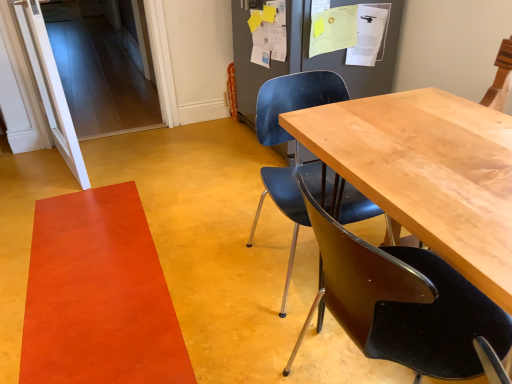
Question: From the image's perspective, does orange matte rug at lower left appear lower than light brown wood table at center?

Choices:
 (A) yes
 (B) no

Answer: (A)

Question: Can you confirm if orange matte rug at lower left is taller than light brown wood table at center?

Choices:
 (A) yes
 (B) no

Answer: (B)

Question: Is orange matte rug at lower left positioned beyond the bounds of light brown wood table at center?

Choices:
 (A) no
 (B) yes

Answer: (B)

Question: Is orange matte rug at lower left shorter than light brown wood table at center?

Choices:
 (A) yes
 (B) no

Answer: (A)

Question: Does orange matte rug at lower left come in front of light brown wood table at center?

Choices:
 (A) no
 (B) yes

Answer: (A)

Question: In the image, is matte black chair at center, which is counted as the 1th chair, starting from the back, positioned in front of or behind orange matte rug at lower left?

Choices:
 (A) front
 (B) behind

Answer: (A)

Question: Is matte black chair at center, which is counted as the second chair, starting from the front, wider or thinner than orange matte rug at lower left?

Choices:
 (A) wide
 (B) thin

Answer: (B)

Question: Considering the positions of point (258, 94) and point (62, 379), is point (258, 94) closer or farther from the camera than point (62, 379)?

Choices:
 (A) farther
 (B) closer

Answer: (A)

Question: Considering the relative positions of matte black chair at center, which is counted as the second chair, starting from the front, and orange matte rug at lower left in the image provided, is matte black chair at center, which is counted as the second chair, starting from the front, to the left or to the right of orange matte rug at lower left?

Choices:
 (A) left
 (B) right

Answer: (B)

Question: Is matte black chair at center, which appears as the 2th chair when viewed from the back, bigger or smaller than matte black chair at center, which is counted as the 1th chair, starting from the back?

Choices:
 (A) big
 (B) small

Answer: (B)

Question: Looking at their shapes, would you say matte black chair at center, which appears as the 2th chair when viewed from the back, is wider or thinner than matte black chair at center, which is counted as the 1th chair, starting from the back?

Choices:
 (A) thin
 (B) wide

Answer: (A)

Question: From a real-world perspective, relative to matte black chair at center, which is counted as the second chair, starting from the front, is matte black chair at center, which is the 1th chair from front to back, vertically above or below?

Choices:
 (A) above
 (B) below

Answer: (A)

Question: From the image's perspective, is matte black chair at center, which is the 1th chair from front to back, above or below matte black chair at center, which is counted as the 1th chair, starting from the back?

Choices:
 (A) below
 (B) above

Answer: (A)

Question: Do you think orange matte rug at lower left is within light brown wood table at center, or outside of it?

Choices:
 (A) inside
 (B) outside

Answer: (B)

Question: Does point (33, 271) appear closer or farther from the camera than point (364, 172)?

Choices:
 (A) closer
 (B) farther

Answer: (B)